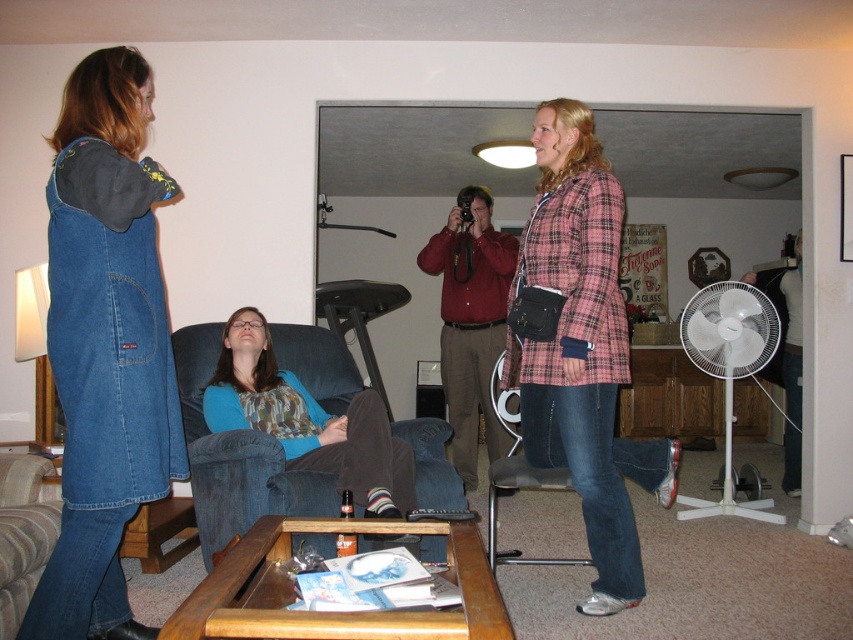
Describe the element at coordinates (105, 346) in the screenshot. I see `denim overall at left` at that location.

Is denim overall at left smaller than matte red shirt at center?

Yes, denim overall at left is smaller than matte red shirt at center.

This screenshot has height=640, width=853. What are the coordinates of `denim overall at left` in the screenshot? It's located at (105, 346).

Who is taller, blue fabric couch at center or matte red shirt at center?

matte red shirt at center is taller.

Consider the image. Who is lower down, blue fabric couch at center or matte red shirt at center?

blue fabric couch at center is below.

Which is behind, point (202, 532) or point (479, 348)?

Point (479, 348)

The width and height of the screenshot is (853, 640). Find the location of `blue fabric couch at center`. blue fabric couch at center is located at coordinates (230, 467).

Describe the element at coordinates (22, 532) in the screenshot. I see `brown fabric armchair at lower left` at that location.

Between point (6, 515) and point (512, 476), which one is positioned behind?

The point (512, 476) is more distant.

Where is `brown fabric armchair at lower left`? brown fabric armchair at lower left is located at coordinates (22, 532).